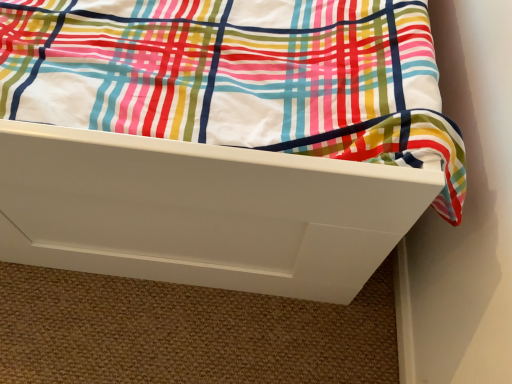
The image size is (512, 384). In order to click on white matte bed at center in this screenshot , I will do `click(220, 140)`.

Describe the element at coordinates (220, 140) in the screenshot. I see `white matte bed at center` at that location.

This screenshot has width=512, height=384. What are the coordinates of `white matte bed at center` in the screenshot? It's located at (220, 140).